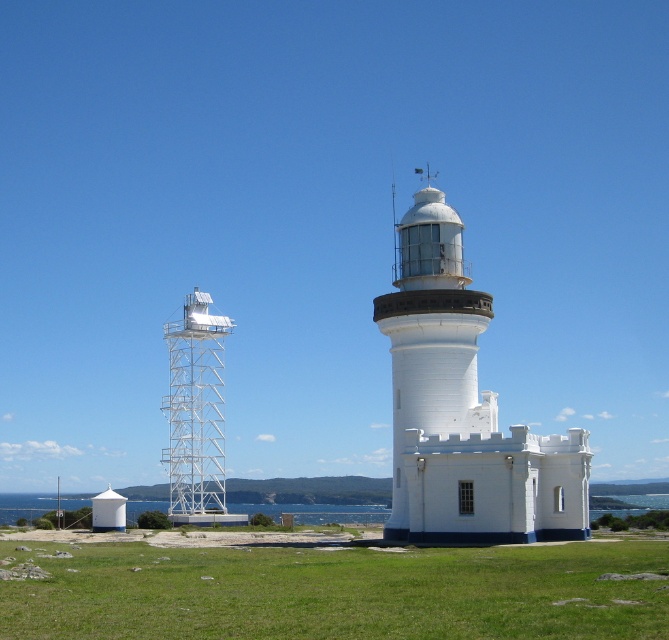
Is green grass at lower center shorter than white smooth lighthouse at center?

Correct, green grass at lower center is not as tall as white smooth lighthouse at center.

Between green grass at lower center and white smooth lighthouse at center, which one has more height?

white smooth lighthouse at center is taller.

Where is `green grass at lower center`? The image size is (669, 640). green grass at lower center is located at coordinates (339, 593).

Image resolution: width=669 pixels, height=640 pixels. I want to click on green grass at lower center, so click(339, 593).

Does point (72, 634) come in front of point (221, 324)?

Yes.

Locate an element on the screen. green grass at lower center is located at coordinates (339, 593).

How distant is white metallic tower at left from blue water at lower center?

white metallic tower at left is 117.18 feet away from blue water at lower center.

Between point (183, 420) and point (256, 504), which one is positioned in front?

Point (183, 420)

At what (x,y) coordinates should I click in order to perform the action: click on white metallic tower at left. Please return your answer as a coordinate pair (x, y). The width and height of the screenshot is (669, 640). Looking at the image, I should click on (195, 413).